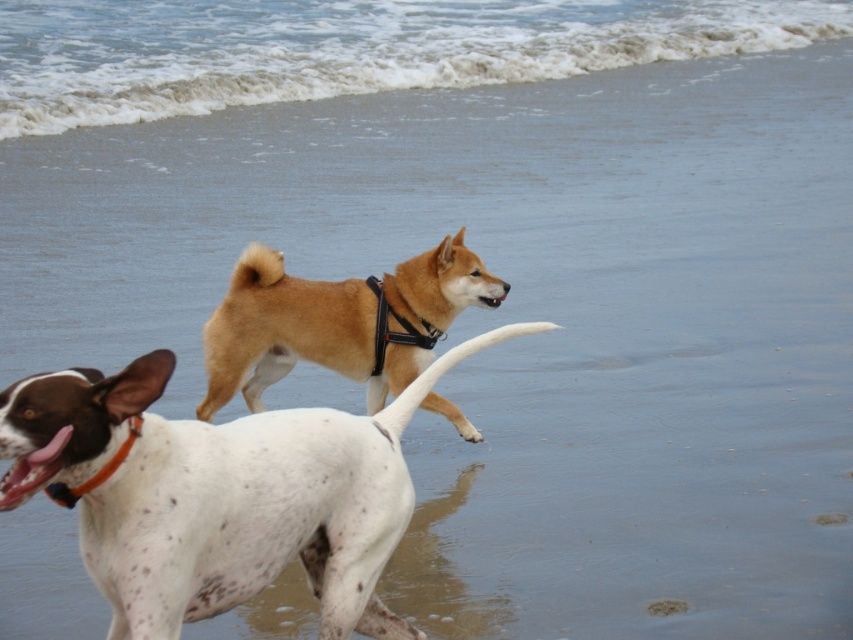
Question: Can you confirm if white speckled fur at center is positioned to the right of orange nylon collar at lower left?

Choices:
 (A) yes
 (B) no

Answer: (A)

Question: Which object is the closest to the golden fur dog at center?

Choices:
 (A) white speckled fur at center
 (B) orange nylon collar at lower left

Answer: (A)

Question: Is golden fur dog at center above orange nylon collar at lower left?

Choices:
 (A) no
 (B) yes

Answer: (B)

Question: Can you confirm if golden fur dog at center is thinner than orange nylon collar at lower left?

Choices:
 (A) yes
 (B) no

Answer: (B)

Question: Which point is closer to the camera?

Choices:
 (A) white speckled fur at center
 (B) orange nylon collar at lower left

Answer: (A)

Question: Which object is closer to the camera taking this photo?

Choices:
 (A) orange nylon collar at lower left
 (B) golden fur dog at center

Answer: (A)